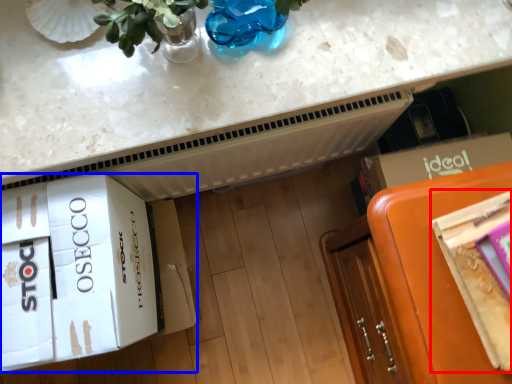
Question: Which object appears farthest to the camera in this image, magazine (highlighted by a red box) or cardboard box (highlighted by a blue box)?

Choices:
 (A) magazine
 (B) cardboard box

Answer: (B)